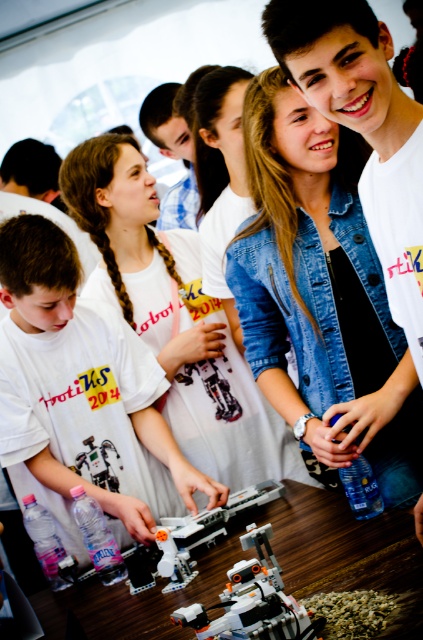
Between denim jacket at upper right and white matte t-shirt at lower left, which one has less height?

white matte t-shirt at lower left is shorter.

From the picture: Who is higher up, denim jacket at upper right or white matte t-shirt at lower left?

denim jacket at upper right is above.

Is point (266, 285) positioned before point (32, 355)?

Yes, it is in front of point (32, 355).

You are a GUI agent. You are given a task and a screenshot of the screen. Output one action in this format:
    pyautogui.click(x=<x>, y=<y>)
    Task: Click on the denim jacket at upper right
    The width and height of the screenshot is (423, 640).
    Given the screenshot: What is the action you would take?
    pyautogui.click(x=320, y=289)

Is white plastic table at lower center closer to camera compared to white plastic robot at center?

Yes, white plastic table at lower center is in front of white plastic robot at center.

The height and width of the screenshot is (640, 423). Find the location of `white plastic table at lower center`. white plastic table at lower center is located at coordinates (279, 563).

Describe the element at coordinates (279, 563) in the screenshot. This screenshot has width=423, height=640. I see `white plastic table at lower center` at that location.

Identify the location of white plastic table at lower center. (279, 563).

Which of these two, denim jacket at upper right or white plastic table at lower center, stands taller?

With more height is denim jacket at upper right.

Does point (308, 300) lie in front of point (151, 605)?

No, (308, 300) is further to viewer.

The width and height of the screenshot is (423, 640). I want to click on denim jacket at upper right, so click(320, 289).